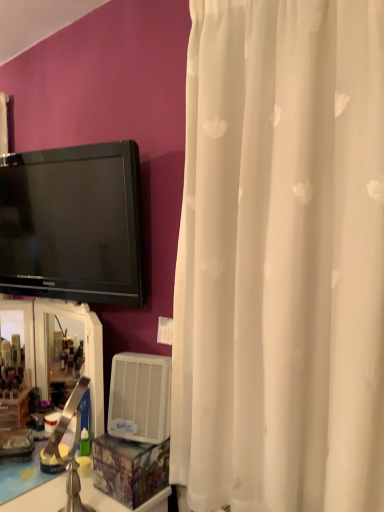
Question: From a real-world perspective, does white plastic air conditioner at lower center stand above translucent plastic mirror at lower left?

Choices:
 (A) no
 (B) yes

Answer: (A)

Question: Is white plastic air conditioner at lower center thinner than translucent plastic mirror at lower left?

Choices:
 (A) yes
 (B) no

Answer: (B)

Question: Is white plastic air conditioner at lower center smaller than translucent plastic mirror at lower left?

Choices:
 (A) yes
 (B) no

Answer: (A)

Question: Does white plastic air conditioner at lower center lie in front of translucent plastic mirror at lower left?

Choices:
 (A) no
 (B) yes

Answer: (B)

Question: Is white plastic air conditioner at lower center completely or partially outside of translucent plastic mirror at lower left?

Choices:
 (A) yes
 (B) no

Answer: (A)

Question: Based on their positions, is white glossy counter top at lower left located to the left or right of white sheer curtain at right?

Choices:
 (A) left
 (B) right

Answer: (A)

Question: From a real-world perspective, is white glossy counter top at lower left above or below white sheer curtain at right?

Choices:
 (A) above
 (B) below

Answer: (B)

Question: Is white glossy counter top at lower left spatially inside white sheer curtain at right, or outside of it?

Choices:
 (A) outside
 (B) inside

Answer: (A)

Question: In terms of height, does white glossy counter top at lower left look taller or shorter compared to white sheer curtain at right?

Choices:
 (A) tall
 (B) short

Answer: (B)

Question: Is brushed metal faucet at lower left bigger or smaller than black glossy tv at upper left?

Choices:
 (A) big
 (B) small

Answer: (B)

Question: Considering their positions, is brushed metal faucet at lower left located in front of or behind black glossy tv at upper left?

Choices:
 (A) behind
 (B) front

Answer: (B)

Question: Is brushed metal faucet at lower left wider or thinner than black glossy tv at upper left?

Choices:
 (A) thin
 (B) wide

Answer: (B)

Question: From the image's perspective, is brushed metal faucet at lower left located above or below black glossy tv at upper left?

Choices:
 (A) above
 (B) below

Answer: (B)

Question: Is white sheer curtain at right wider or thinner than translucent plastic mirror at lower left?

Choices:
 (A) thin
 (B) wide

Answer: (B)

Question: Does point (188, 308) appear closer or farther from the camera than point (92, 394)?

Choices:
 (A) farther
 (B) closer

Answer: (B)